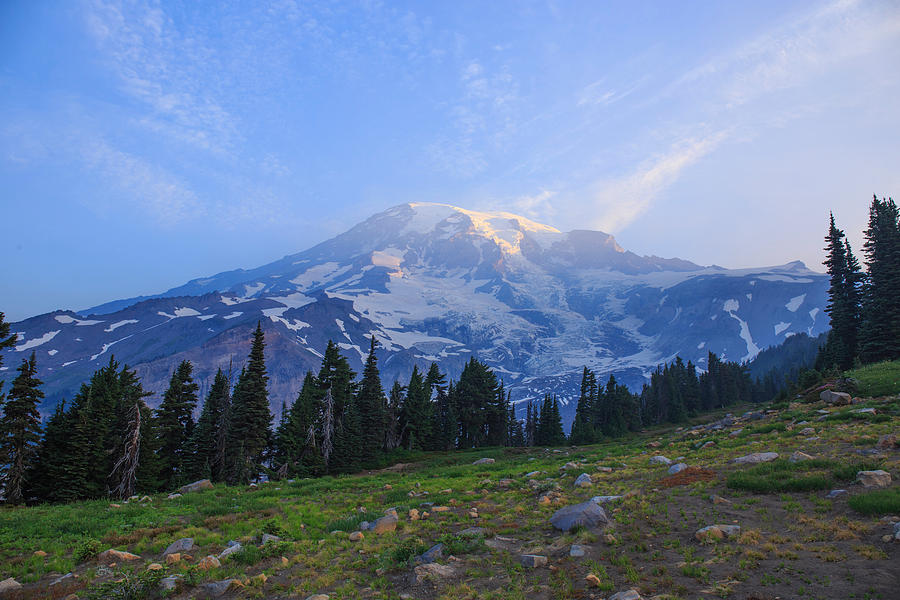
Find the location of `corner`. corner is located at coordinates (879, 583), (20, 580), (32, 41), (880, 26).